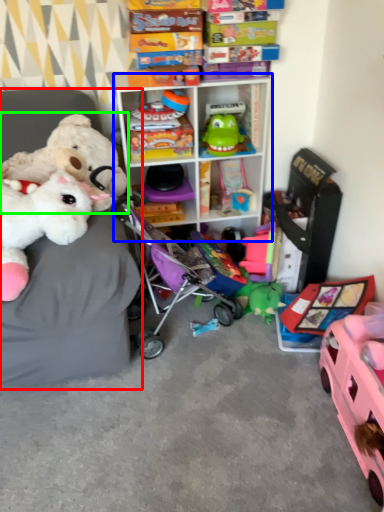
Question: Which object is positioned closest to furniture (highlighted by a red box)? Select from shelf (highlighted by a blue box) and toy (highlighted by a green box).

Choices:
 (A) shelf
 (B) toy

Answer: (B)